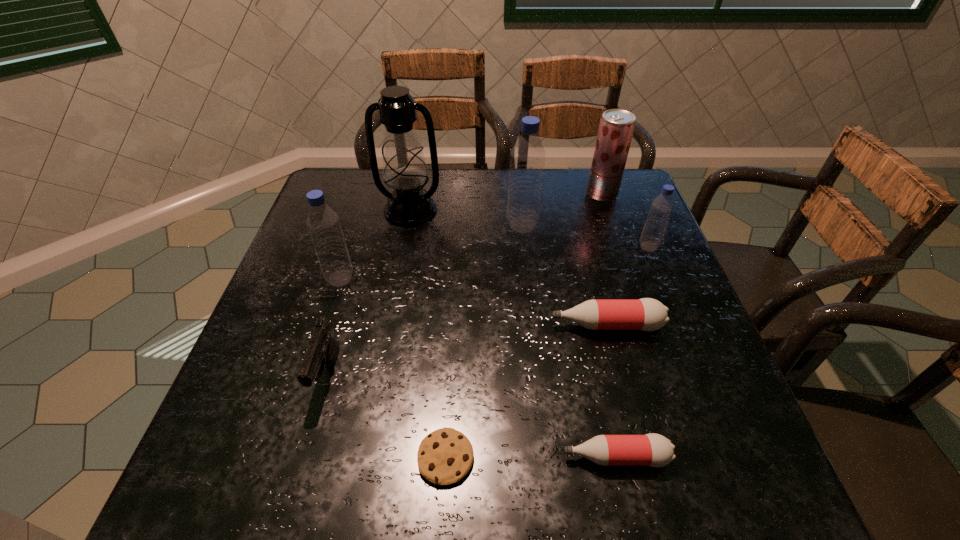
The width and height of the screenshot is (960, 540). In order to click on unoccupied area between the nearer pink bottle and the black pistol in this screenshot , I will do `click(471, 416)`.

Find the location of a particular element. This screenshot has height=540, width=960. free spot between the leftmost bottle and the cookie is located at coordinates (393, 368).

The image size is (960, 540). Identify the location of empty space between the brown cookie and the bigger pink bottle. (526, 392).

Find the location of a particular element. vacant space in between the seventh tallest object and the cookie is located at coordinates (526, 392).

This screenshot has width=960, height=540. In order to click on the seventh closest object to the bigger pink bottle in this screenshot , I will do [323, 350].

The width and height of the screenshot is (960, 540). What are the coordinates of `object identified as the second closest to the smaller pink bottle` in the screenshot? It's located at (646, 314).

Where is `bottle identified as the third closest to the farther pink bottle`? This screenshot has height=540, width=960. bottle identified as the third closest to the farther pink bottle is located at coordinates (527, 158).

Select which bottle is the closest to the fifth tallest object. Please provide its 2D coordinates. Your answer should be formatted as a tuple, i.e. [(x, y)], where the tuple contains the x and y coordinates of a point satisfying the conditions above.

[(646, 314)]

Identify which blue bottle is the second nearest to the third object from left to right. Please provide its 2D coordinates. Your answer should be formatted as a tuple, i.e. [(x, y)], where the tuple contains the x and y coordinates of a point satisfying the conditions above.

[(527, 158)]

This screenshot has height=540, width=960. Identify the location of blue bottle that stands as the third closest to the farther pink bottle. (323, 223).